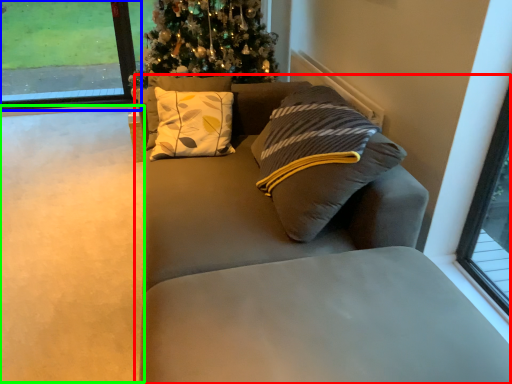
Question: Considering the real-world distances, which object is closest to studio couch (highlighted by a red box)? window (highlighted by a blue box) or golf course (highlighted by a green box).

Choices:
 (A) window
 (B) golf course

Answer: (B)